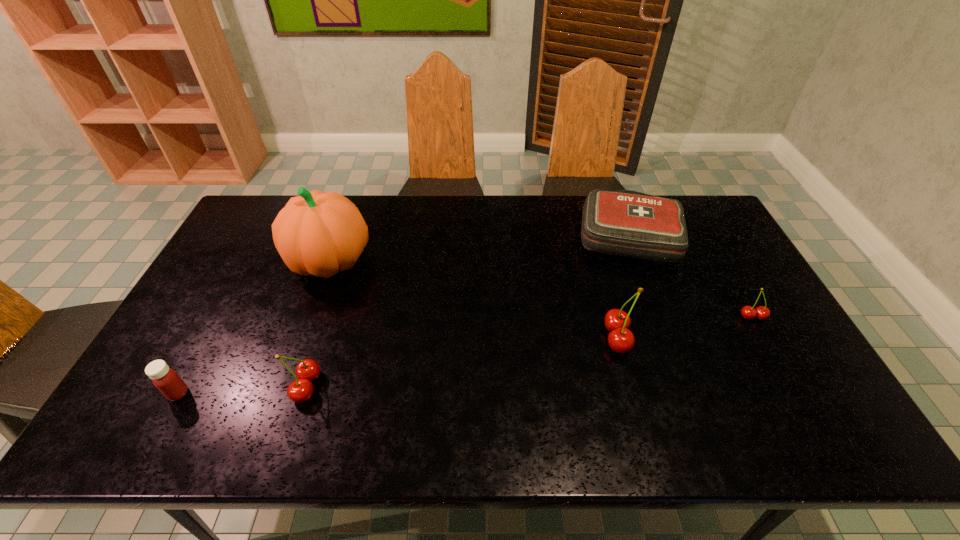
Point out which object is positioned as the fourth nearest to the second cherry from left to right. Please provide its 2D coordinates. Your answer should be formatted as a tuple, i.e. [(x, y)], where the tuple contains the x and y coordinates of a point satisfying the conditions above.

[(299, 391)]

Locate which cherry ranks in proximity to the second cherry from right to left. Please provide its 2D coordinates. Your answer should be formatted as a tuple, i.e. [(x, y)], where the tuple contains the x and y coordinates of a point satisfying the conditions above.

[(748, 312)]

Where is `cherry that is the nearest to the second cherry from left to right`? This screenshot has width=960, height=540. cherry that is the nearest to the second cherry from left to right is located at coordinates (748, 312).

Locate an element on the screen. The width and height of the screenshot is (960, 540). vacant space that satisfies the following two spatial constraints: 1. on the front side of the first-aid kit; 2. with the stems of the leftmost cherry pointing upwards is located at coordinates (688, 386).